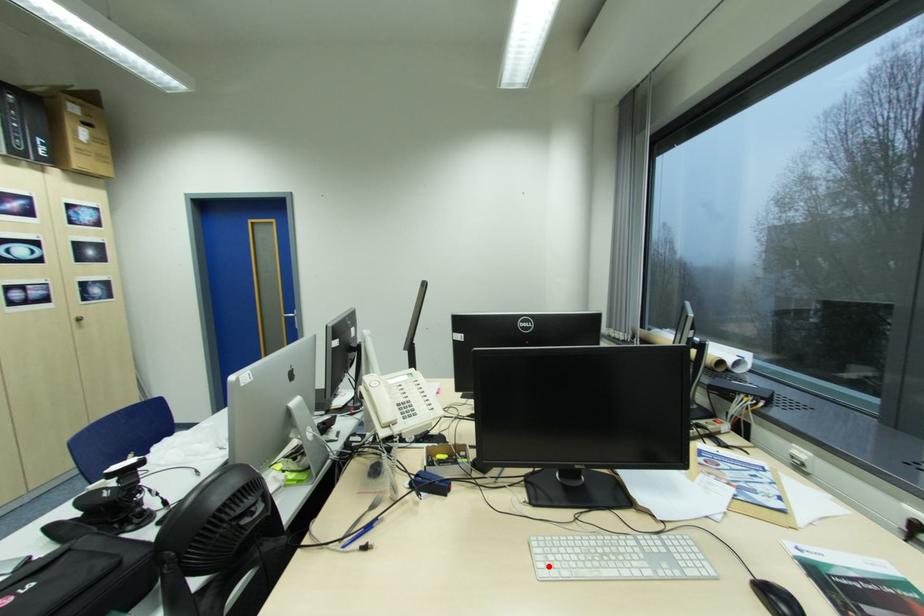
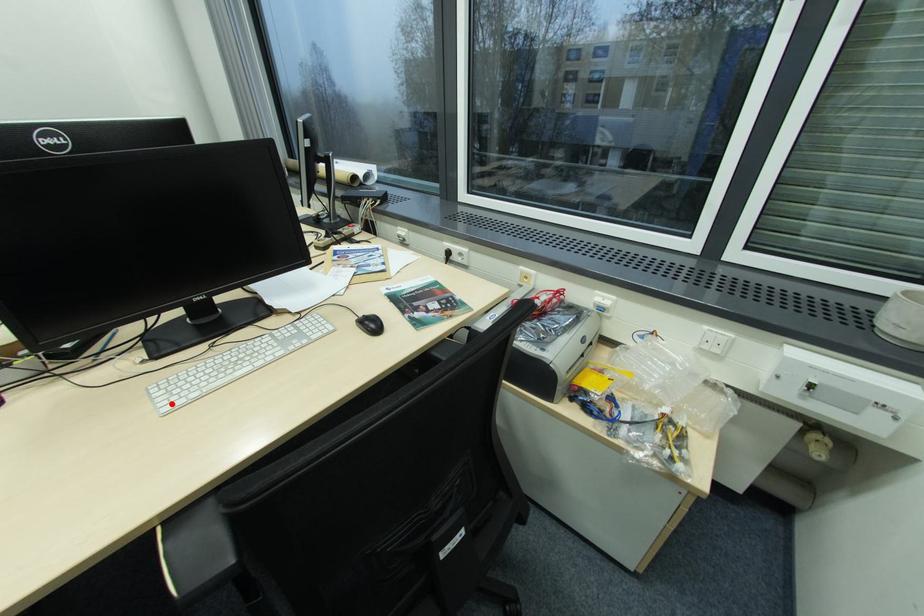
I am providing you with two images of the same scene from different viewpoints. A red point is marked on the first image and another point is marked on the second image. Does the point marked in image1 correspond to the same location as the one in image2?

Yes